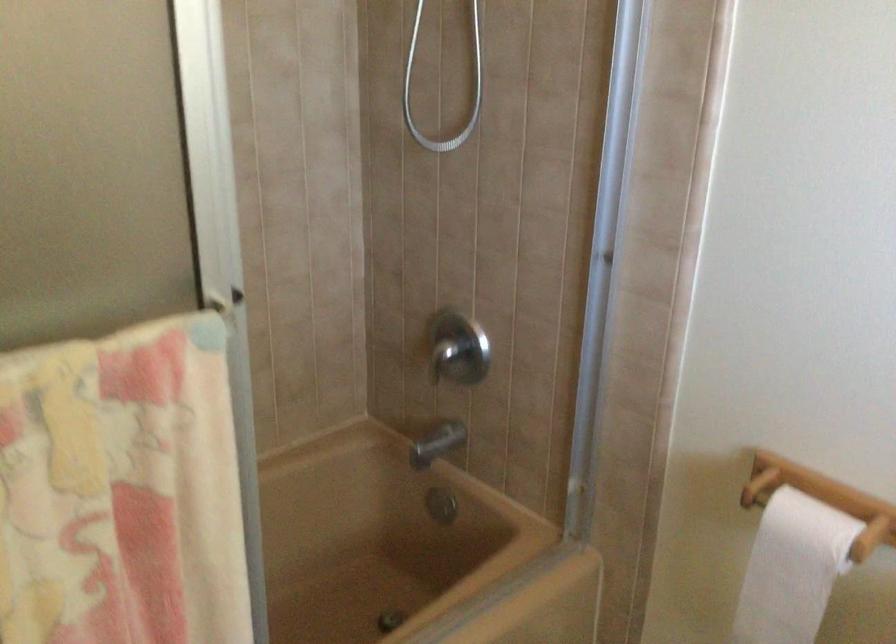
Describe the element at coordinates (458, 348) in the screenshot. I see `a faucet diverter knob` at that location.